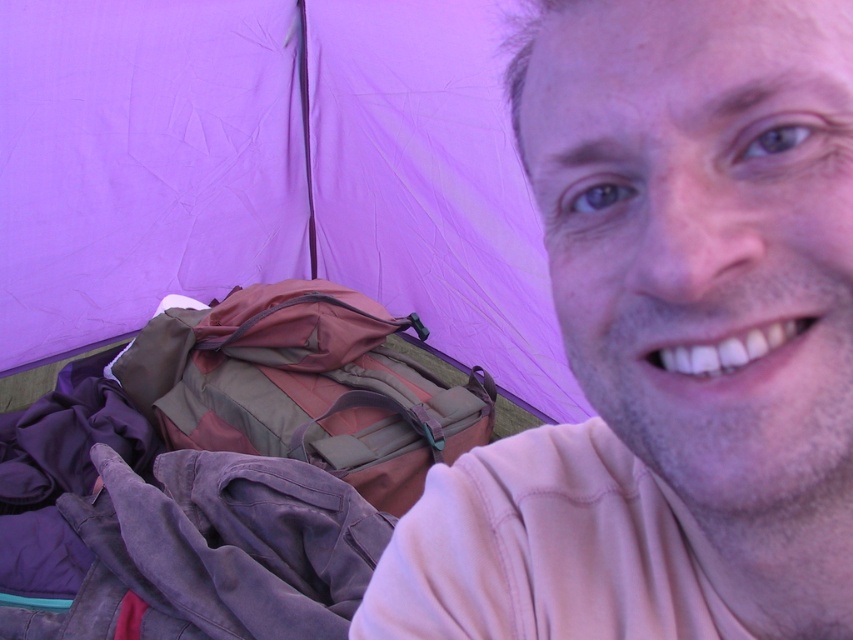
You are inside a tent and want to place a small item on the closest point between point (323, 17) and point (225, 336). Which point should you choose?

Point (323, 17) is closer to you than point (225, 336), so you should place the item on point (323, 17).

You are setting up a tent and need to compare the height of the pink fabric at upper right and the purple fabric tent at center. Which one is shorter?

The pink fabric at upper right is shorter than the purple fabric tent at center because it is not as tall.